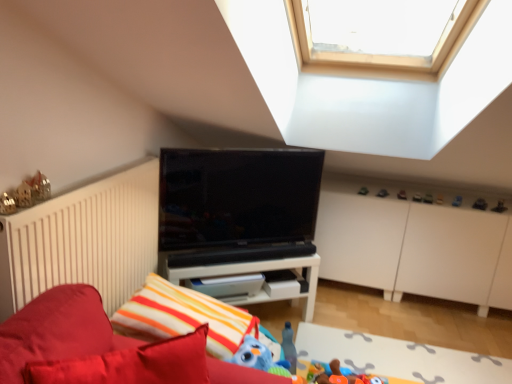
Find the location of a particular element. The image size is (512, 384). vacant space behind matte black toy car at upper center, acting as the 4th toy starting from the back is located at coordinates (417, 190).